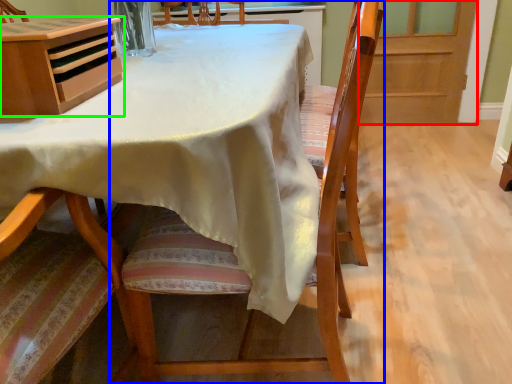
Question: Considering the real-world distances, which object is closest to screen door (highlighted by a red box)? chair (highlighted by a blue box) or cabinetry (highlighted by a green box).

Choices:
 (A) chair
 (B) cabinetry

Answer: (A)